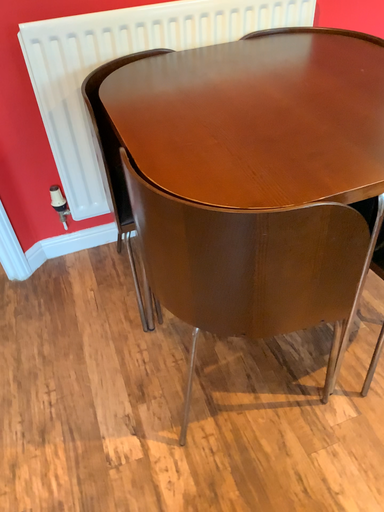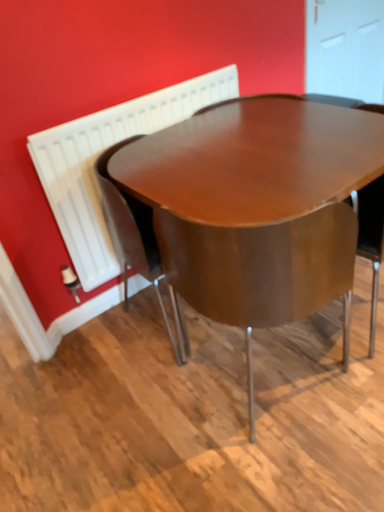
Question: How did the camera likely rotate when shooting the video?

Choices:
 (A) rotated right
 (B) rotated left

Answer: (A)